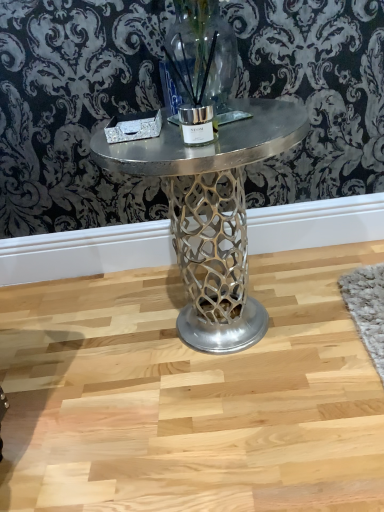
Find the location of a particular element. metallic silver table at center is located at coordinates (212, 214).

What do you see at coordinates (212, 214) in the screenshot? I see `metallic silver table at center` at bounding box center [212, 214].

You are a GUI agent. You are given a task and a screenshot of the screen. Output one action in this format:
    pyautogui.click(x=<x>, y=<y>)
    Task: Click on the metallic silver table at center
    The image size is (384, 512).
    Given the screenshot: What is the action you would take?
    pyautogui.click(x=212, y=214)